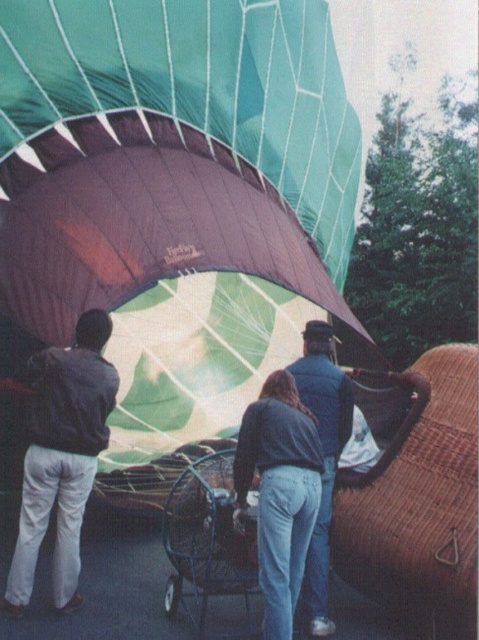
Who is positioned more to the right, denim jacket at center or dark blue jacket at left?

denim jacket at center

Which is behind, point (283, 595) or point (69, 605)?

The point (69, 605) is behind.

The height and width of the screenshot is (640, 479). In order to click on denim jacket at center in this screenshot , I will do `click(295, 474)`.

Can you confirm if denim jacket at center is wider than metallic silver baby carriage at center?

Yes.

Which is behind, point (273, 544) or point (195, 481)?

Point (195, 481)

Find the location of a particular element. The image size is (479, 640). denim jacket at center is located at coordinates pos(295,474).

Does point (26, 481) come behind point (198, 618)?

No, it is not.

Which is behind, point (114, 385) or point (175, 570)?

The point (175, 570) is more distant.

Where is `dark blue jacket at left`? Image resolution: width=479 pixels, height=640 pixels. dark blue jacket at left is located at coordinates (61, 458).